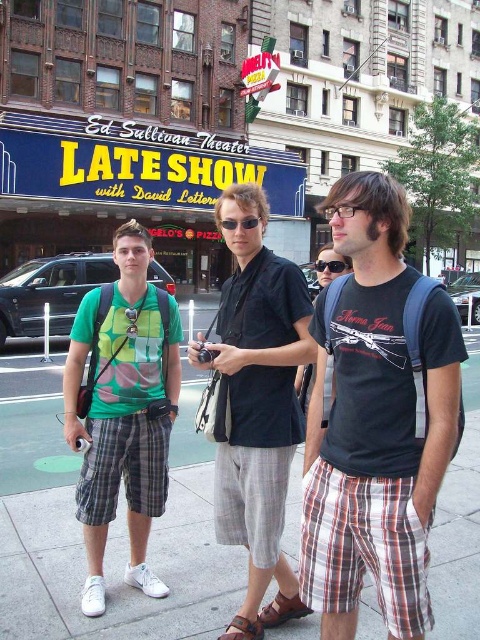
From the picture: You are standing on the sidewalk in front of the theater and want to take a photo of the black cotton shirt at center without including the gray concrete pavement at center in the frame. Is this possible given their positions?

The gray concrete pavement at center is closer to the viewer than the black cotton shirt at center. To avoid including the gray concrete pavement at center in the photo, you would need to adjust your position or angle so that the black cotton shirt at center is framed without the closer pavement obstructing or appearing in the shot.